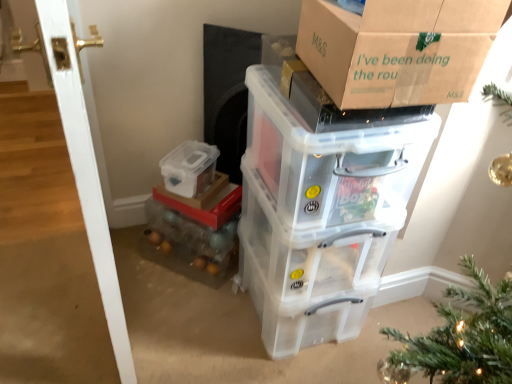
This screenshot has width=512, height=384. Identify the location of vacant area situated to the left side of white glossy door at left. (30, 286).